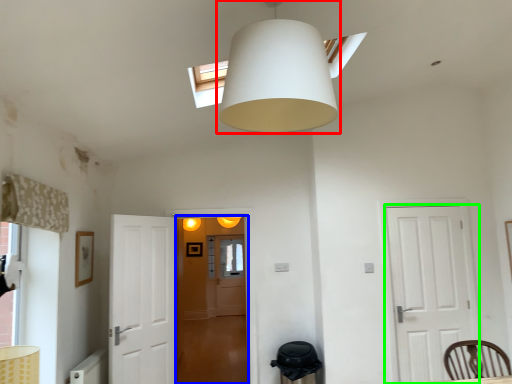
Question: Which object is the closest to the lamp (highlighted by a red box)? Choose among these: glass door (highlighted by a blue box) or door (highlighted by a green box).

Choices:
 (A) glass door
 (B) door

Answer: (B)